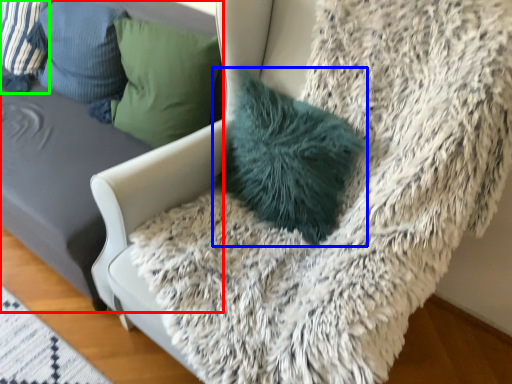
Question: Which object is the farthest from furniture (highlighted by a red box)? Choose among these: pillow (highlighted by a blue box) or pillow (highlighted by a green box).

Choices:
 (A) pillow
 (B) pillow

Answer: (A)